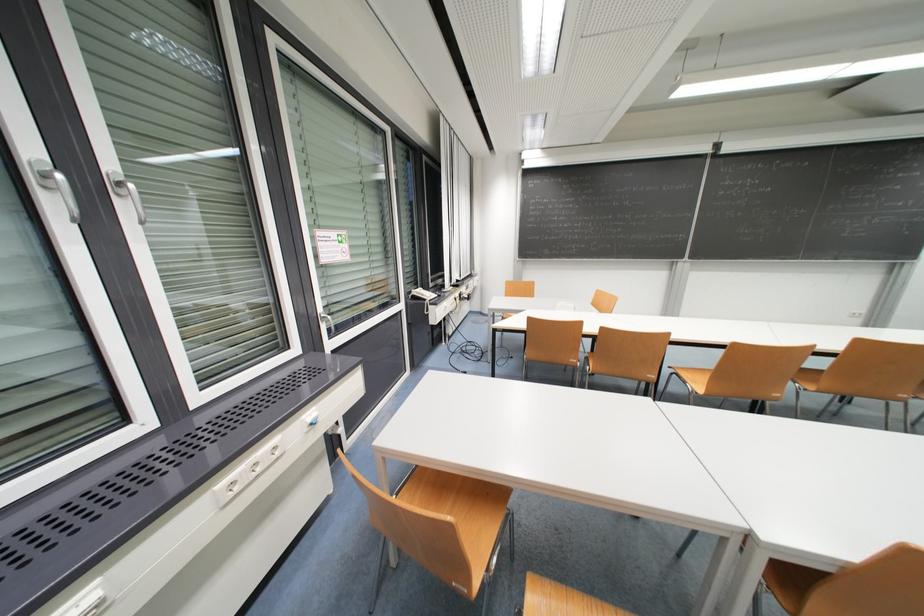
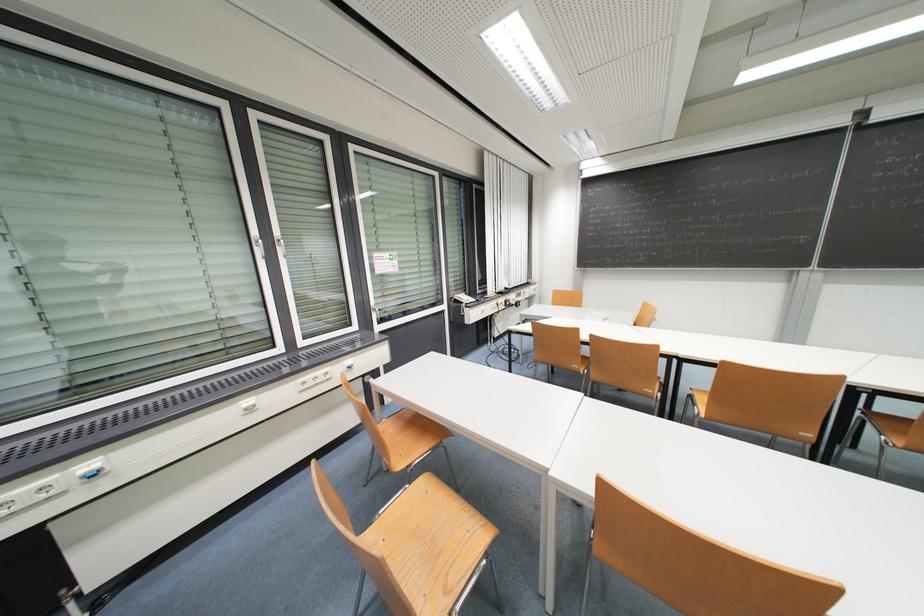
Question: The images are taken continuously from a first-person perspective. In which direction is your viewpoint rotating?

Choices:
 (A) Left
 (B) Right
 (C) Up
 (D) Down

Answer: (A)